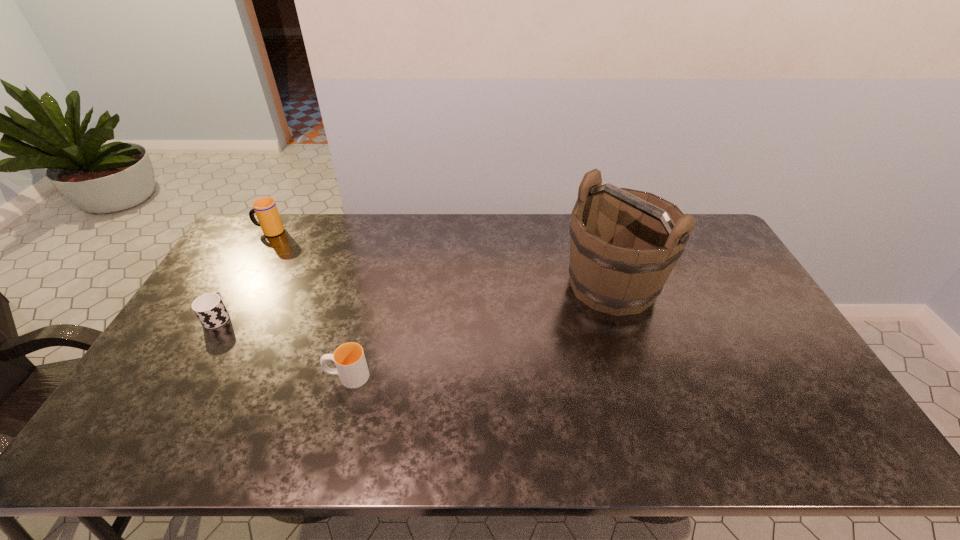
The height and width of the screenshot is (540, 960). I want to click on vacant region that satisfies the following two spatial constraints: 1. with the handle on the side of the nearest cup; 2. on the right side of the tallest object, so click(x=372, y=285).

The width and height of the screenshot is (960, 540). In order to click on vacant area in the image that satisfies the following two spatial constraints: 1. on the side of the shortest object with the handle; 2. on the left side of the rightmost object in this screenshot , I will do `click(237, 285)`.

The height and width of the screenshot is (540, 960). Identify the location of vacant space that satisfies the following two spatial constraints: 1. on the side of the shortest cup with the handle; 2. on the left side of the tallest object. (237, 285).

This screenshot has width=960, height=540. Identify the location of free space that satisfies the following two spatial constraints: 1. with the handle on the side of the third tallest object; 2. on the back side of the bucket. (372, 285).

Where is `free space that satisfies the following two spatial constraints: 1. on the side of the shortest cup with the handle; 2. on the side of the tallest cup with the handle`? Image resolution: width=960 pixels, height=540 pixels. free space that satisfies the following two spatial constraints: 1. on the side of the shortest cup with the handle; 2. on the side of the tallest cup with the handle is located at coordinates (269, 231).